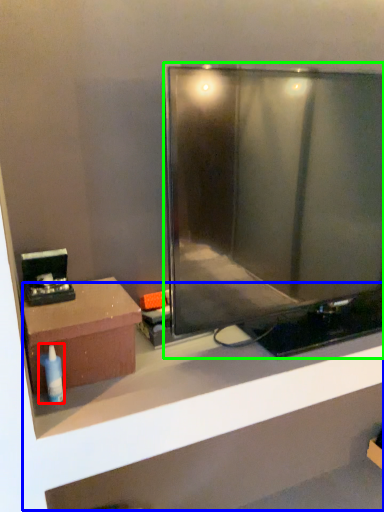
Question: Based on their relative distances, which object is nearer to toiletry (highlighted by a red box)? Choose from shelf (highlighted by a blue box) and television (highlighted by a green box).

Choices:
 (A) shelf
 (B) television

Answer: (B)